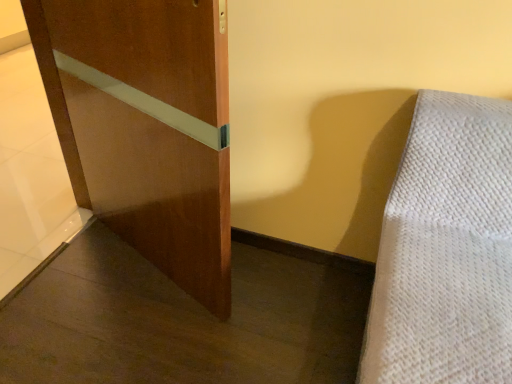
I want to click on vacant space to the right of glossy wood door at center, so click(288, 294).